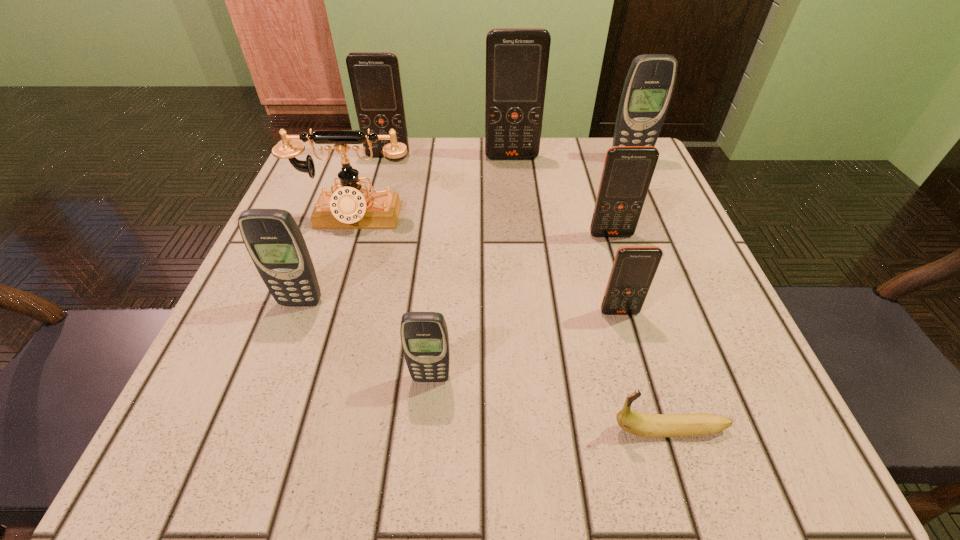
The image size is (960, 540). Find the location of `the fourth closest cellular telephone to the farthest gray cellular telephone`. the fourth closest cellular telephone to the farthest gray cellular telephone is located at coordinates (375, 80).

At what (x,y) coordinates should I click in order to perform the action: click on cellular telephone that is the third closest to the banana. Please return your answer as a coordinate pair (x, y). The width and height of the screenshot is (960, 540). Looking at the image, I should click on click(628, 170).

Select which orange cellular telephone appears as the closest to the biggest orange cellular telephone. Please provide its 2D coordinates. Your answer should be formatted as a tuple, i.e. [(x, y)], where the tuple contains the x and y coordinates of a point satisfying the conditions above.

[(375, 80)]

Where is `orange cellular telephone that stands as the closest to the second biggest orange cellular telephone`? Image resolution: width=960 pixels, height=540 pixels. orange cellular telephone that stands as the closest to the second biggest orange cellular telephone is located at coordinates (517, 59).

Choose which gray cellular telephone is the nearest neighbor to the third cellular telephone from left to right. Please provide its 2D coordinates. Your answer should be formatted as a tuple, i.e. [(x, y)], where the tuple contains the x and y coordinates of a point satisfying the conditions above.

[(275, 243)]

At what (x,y) coordinates should I click in order to perform the action: click on gray cellular telephone that is the closest one to the nearest orange cellular telephone. Please return your answer as a coordinate pair (x, y). The height and width of the screenshot is (540, 960). Looking at the image, I should click on (424, 335).